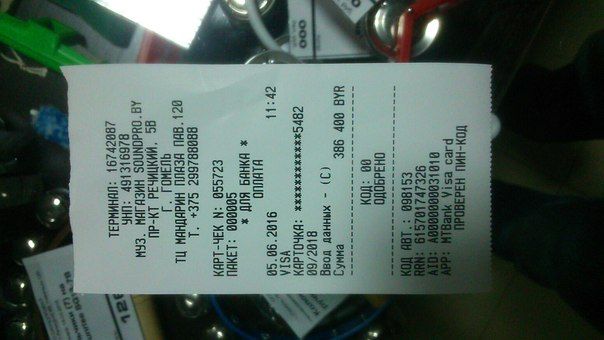
Where is `blue duster or brush`? Image resolution: width=604 pixels, height=340 pixels. blue duster or brush is located at coordinates (54, 130), (47, 117).